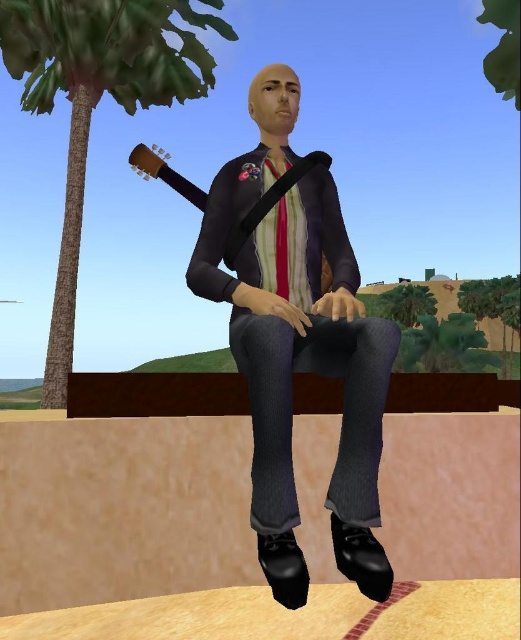
Question: Is matte black jacket at center above red satin tie at center?

Choices:
 (A) yes
 (B) no

Answer: (B)

Question: Among these points, which one is farthest from the camera?

Choices:
 (A) (231, 234)
 (B) (80, 113)

Answer: (B)

Question: Does wooden acoustic guitar at center have a greater width compared to green leafy tree at center?

Choices:
 (A) yes
 (B) no

Answer: (B)

Question: Which point is closer to the camera taking this photo?

Choices:
 (A) (380, 397)
 (B) (32, 93)
 (C) (389, 298)
 (D) (282, 209)

Answer: (A)

Question: In this image, where is green leafy palm tree at upper left located relative to wooden acoustic guitar at center?

Choices:
 (A) left
 (B) right

Answer: (A)

Question: Which object is the closest to the matte black jacket at center?

Choices:
 (A) wooden acoustic guitar at center
 (B) red satin tie at center
 (C) green leafy palm tree at upper left
 (D) green leafy tree at center

Answer: (B)